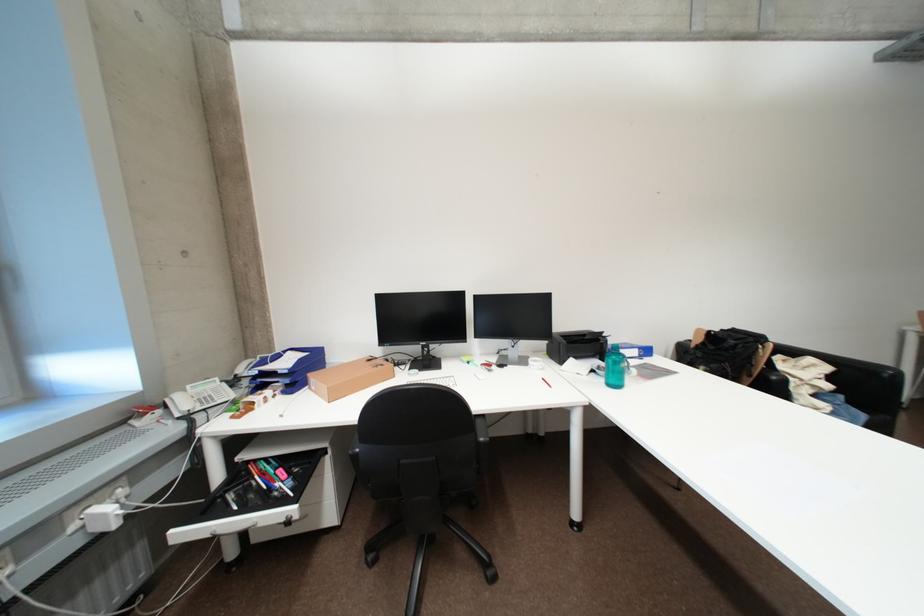
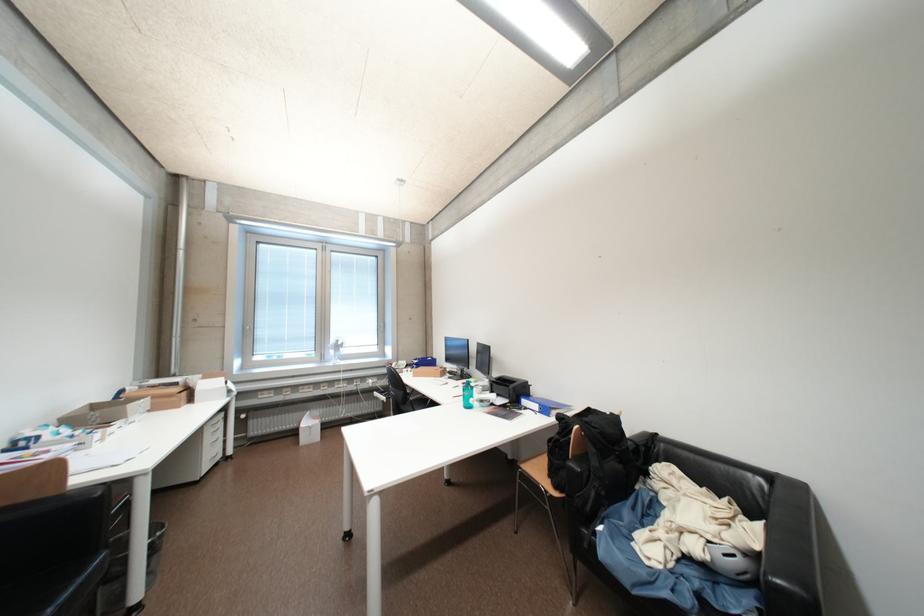
Find the pixel in the second image that matches point (818, 362) in the first image.

(769, 528)